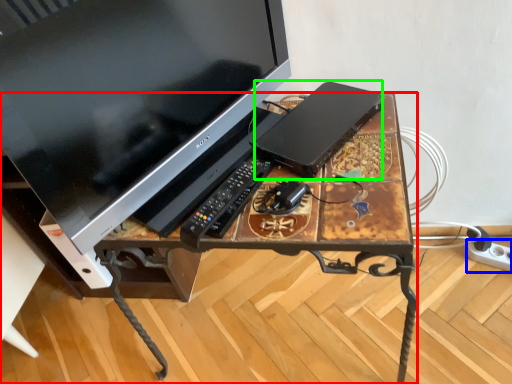
Question: Which object is the closest to the desk (highlighted by a red box)? Choose among these: extension cord (highlighted by a blue box) or computer (highlighted by a green box).

Choices:
 (A) extension cord
 (B) computer

Answer: (B)